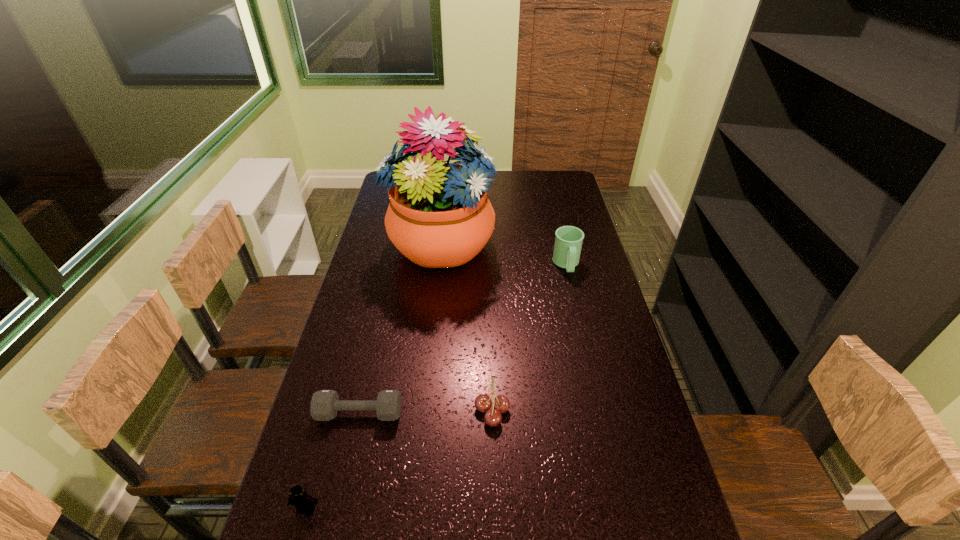
At what (x,y) coordinates should I click in order to perform the action: click on vacant space that satisfies the following two spatial constraints: 1. on the leaves of the cherry; 2. on the face of the nearest object. Please return your answer as a coordinate pair (x, y). Image resolution: width=960 pixels, height=540 pixels. Looking at the image, I should click on (494, 509).

This screenshot has width=960, height=540. In order to click on free space that satisfies the following two spatial constraints: 1. on the side of the mug with the handle; 2. on the leaves of the cherry in this screenshot , I will do `click(600, 410)`.

Where is `vacant area in the image that satisfies the following two spatial constraints: 1. on the back side of the dumbbell; 2. on the left side of the flower arrangement`? The image size is (960, 540). vacant area in the image that satisfies the following two spatial constraints: 1. on the back side of the dumbbell; 2. on the left side of the flower arrangement is located at coordinates (398, 244).

In order to click on free space that satisfies the following two spatial constraints: 1. on the leaves of the cherry; 2. on the face of the nearest object in this screenshot , I will do `click(494, 509)`.